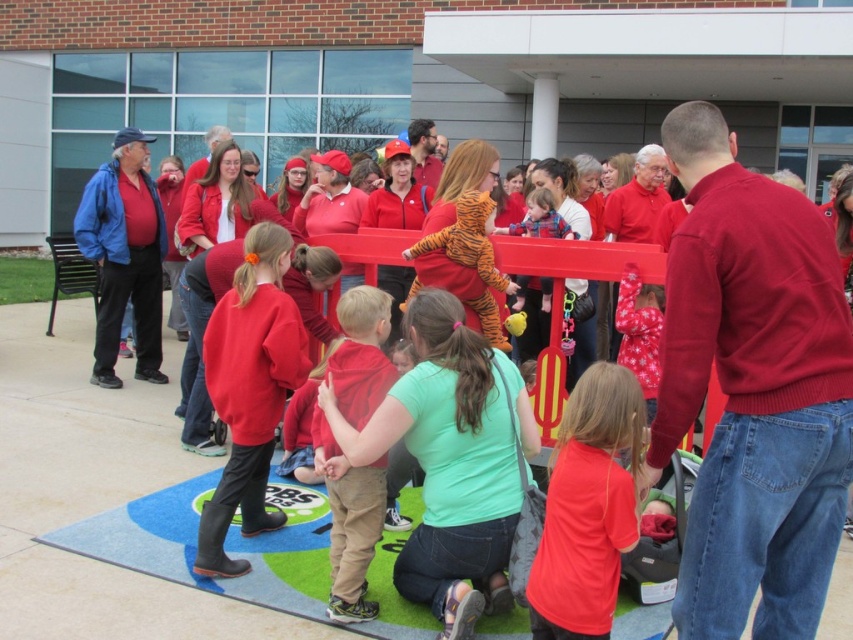
Question: Does blue artificial turf mat at lower center have a greater width compared to matte red sweatshirt at center?

Choices:
 (A) no
 (B) yes

Answer: (B)

Question: Which of the following is the farthest from the observer?

Choices:
 (A) matte red shirt at center
 (B) blue artificial turf mat at lower center

Answer: (B)

Question: Is blue artificial turf mat at lower center thinner than matte red shirt at center?

Choices:
 (A) no
 (B) yes

Answer: (A)

Question: Considering the real-world distances, which object is farthest from the blue artificial turf mat at lower center?

Choices:
 (A) matte red sweatshirt at center
 (B) matte red shirt at center

Answer: (B)

Question: Is matte red shirt at center closer to camera compared to matte red sweatshirt at center?

Choices:
 (A) no
 (B) yes

Answer: (B)

Question: Among these points, which one is nearest to the camera?

Choices:
 (A) (563, 528)
 (B) (236, 417)
 (C) (633, 611)

Answer: (A)